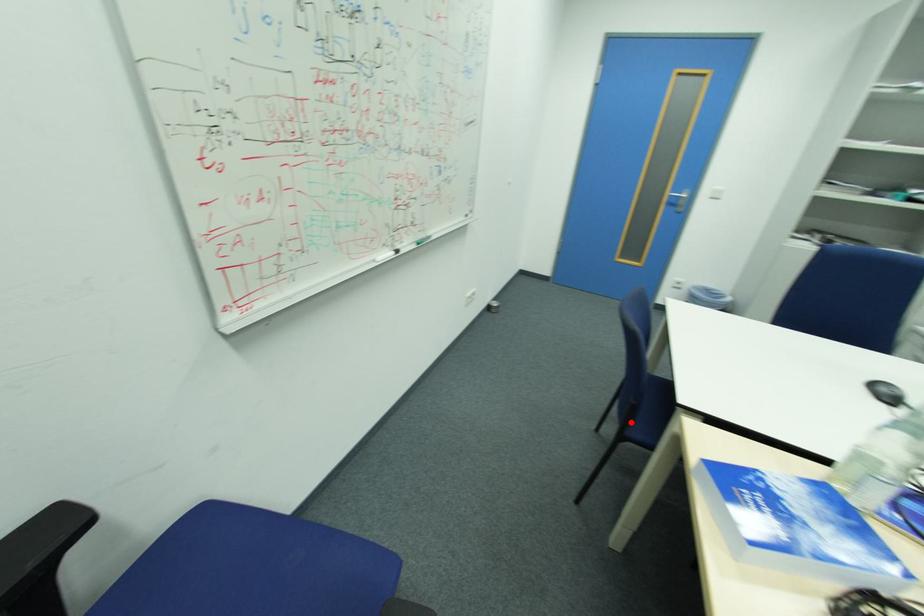
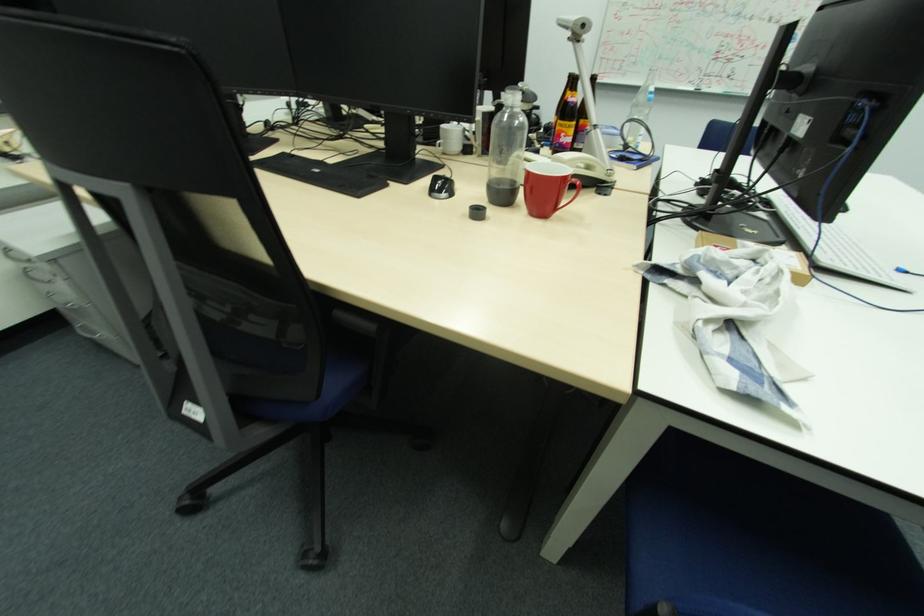
Question: I am providing you with two images of the same scene from different viewpoints. A red point is marked on the first image. At the location where the point appears in image 1, is it still visible in image 2?

Choices:
 (A) Yes
 (B) No

Answer: (B)